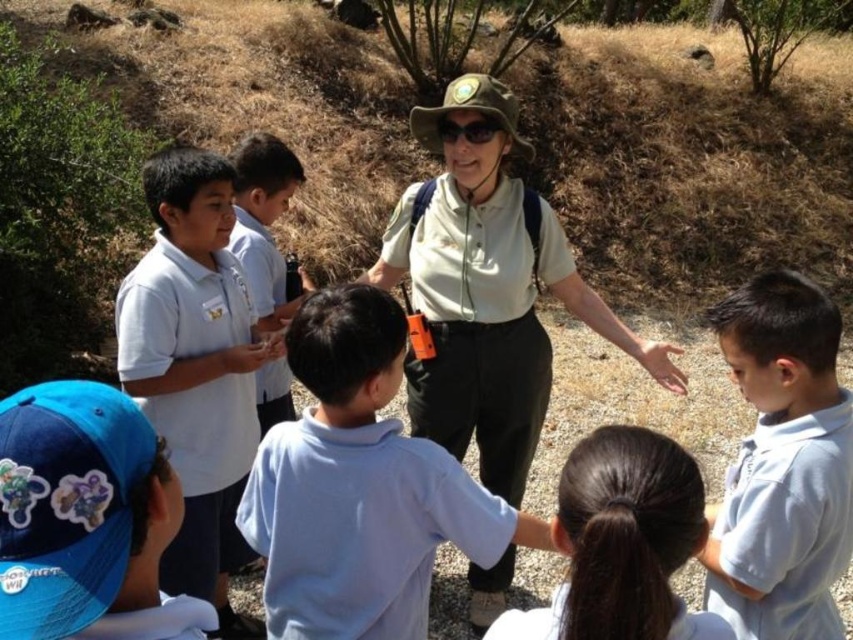
You are a photographer trying to capture a candid shot of the adult in the scene. You notice the matte khaki shirt at center and the smooth skin hand at center. Which object should you focus on first if you want to ensure both are in the frame?

You should focus on the smooth skin hand at center first because it is above the matte khaki shirt at center, making it easier to frame both elements together.

You are a photographer trying to capture a clear shot of both the white cotton shirt at center and the white matte uniform at lower center. Since you want to ensure both are visible, which one should you focus on first considering their sizes?

The white cotton shirt at center is bigger than the white matte uniform at lower center, so you should focus on the white cotton shirt at center first as it occupies more space in the frame and will require proper focus to ensure clarity.

You are a photographer trying to capture a group photo of the adult and children in the scene. The adult is wearing a white cotton shirt at center and a white matte uniform at lower center. Which clothing item should you focus on to ensure the adult is clearly visible in the photo?

The white cotton shirt at center might be wider than the white matte uniform at lower center, so focusing on the white cotton shirt at center would ensure the adult is clearly visible due to its potentially larger size.